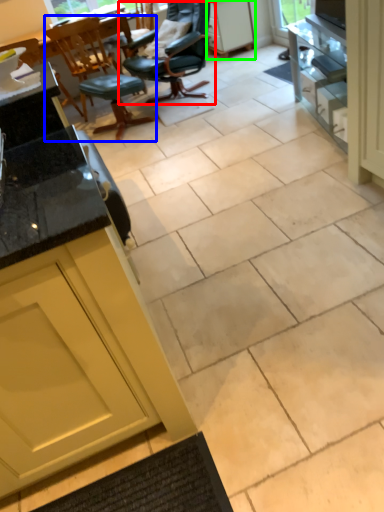
Question: Which object is the closest to the chair (highlighted by a red box)? Choose among these: chair (highlighted by a blue box) or cabinetry (highlighted by a green box).

Choices:
 (A) chair
 (B) cabinetry

Answer: (A)